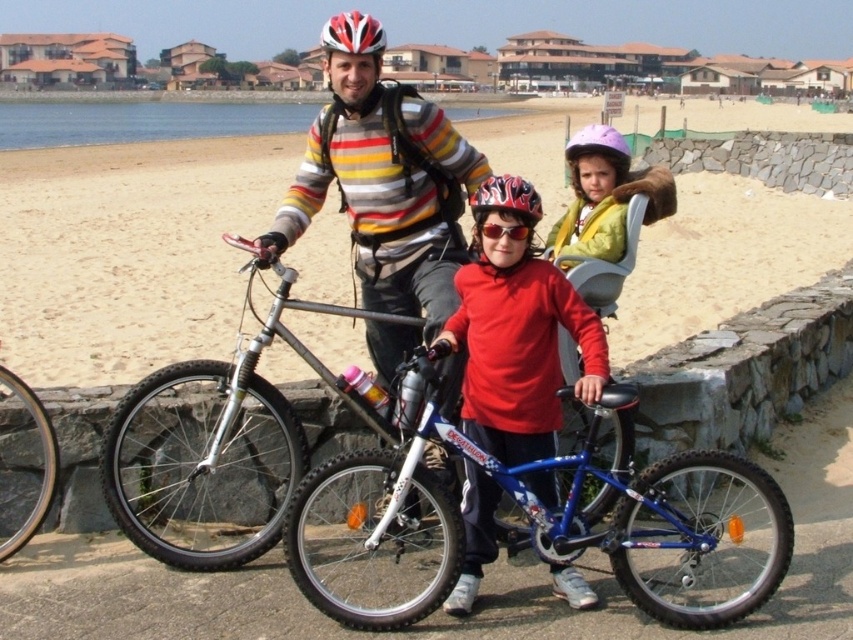
Consider the image. Measure the distance from blue metallic bicycle at center to red matte bicycle helmet at upper center.

blue metallic bicycle at center is 3.64 meters from red matte bicycle helmet at upper center.

Which is more to the left, blue metallic bicycle at center or red matte bicycle helmet at upper center?

From the viewer's perspective, red matte bicycle helmet at upper center appears more on the left side.

Where is `blue metallic bicycle at center`? blue metallic bicycle at center is located at coordinates (544, 522).

Which is in front, point (624, 164) or point (476, 205)?

Point (476, 205) is more forward.

Is point (582, 138) behind point (471, 200)?

That is True.

Who is more forward, (570, 144) or (515, 202)?

Point (515, 202)

The height and width of the screenshot is (640, 853). Identify the location of purple matte helmet at center. (596, 154).

Is silver metallic bicycle at center above shiny multicolored helmet at center?

No, silver metallic bicycle at center is not above shiny multicolored helmet at center.

Does silver metallic bicycle at center have a lesser width compared to shiny multicolored helmet at center?

Indeed, silver metallic bicycle at center has a lesser width compared to shiny multicolored helmet at center.

Locate an element on the screen. silver metallic bicycle at center is located at coordinates (221, 451).